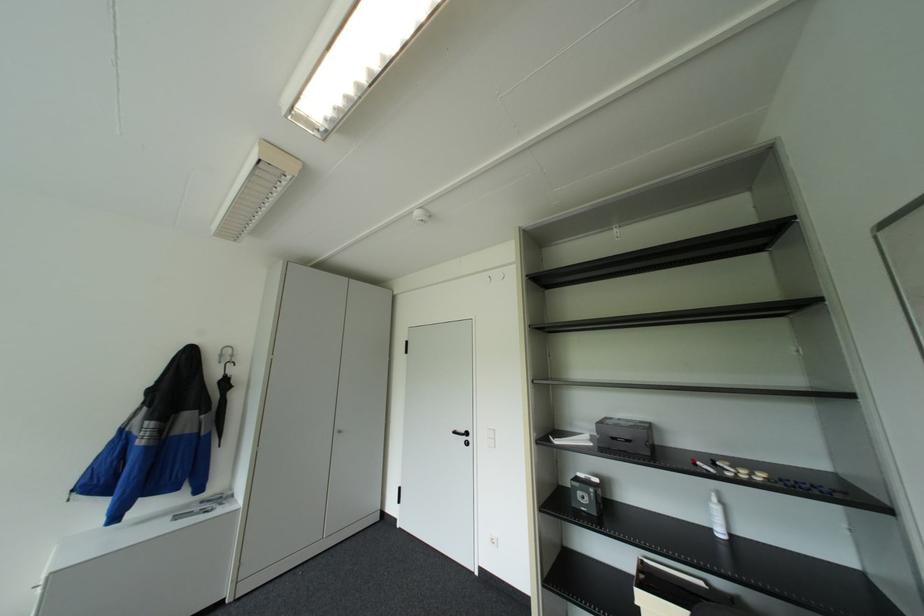
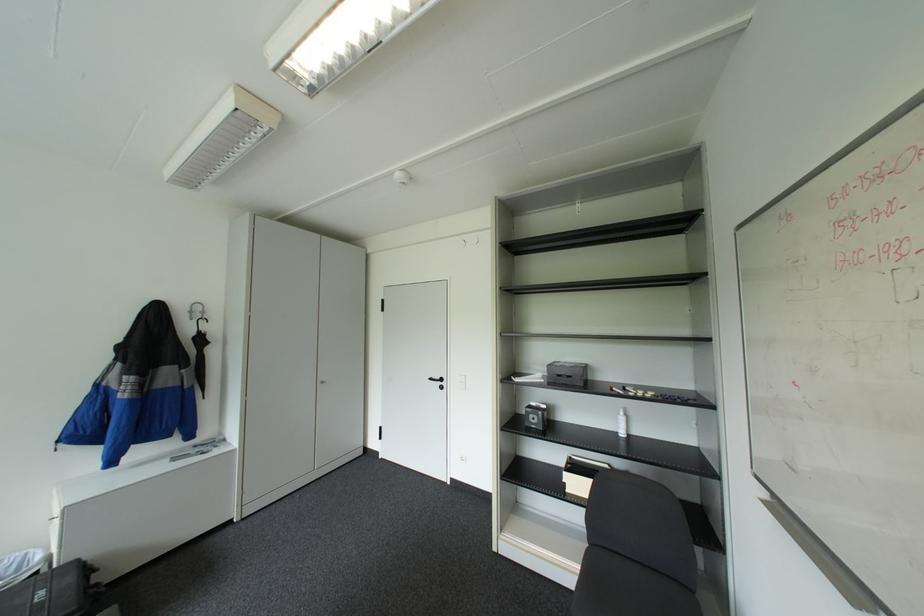
Question: Based on the continuous images, in which direction is the camera rotating? Reply with the corresponding letter.

Choices:
 (A) Left
 (B) Right
 (C) Up
 (D) Down

Answer: (D)